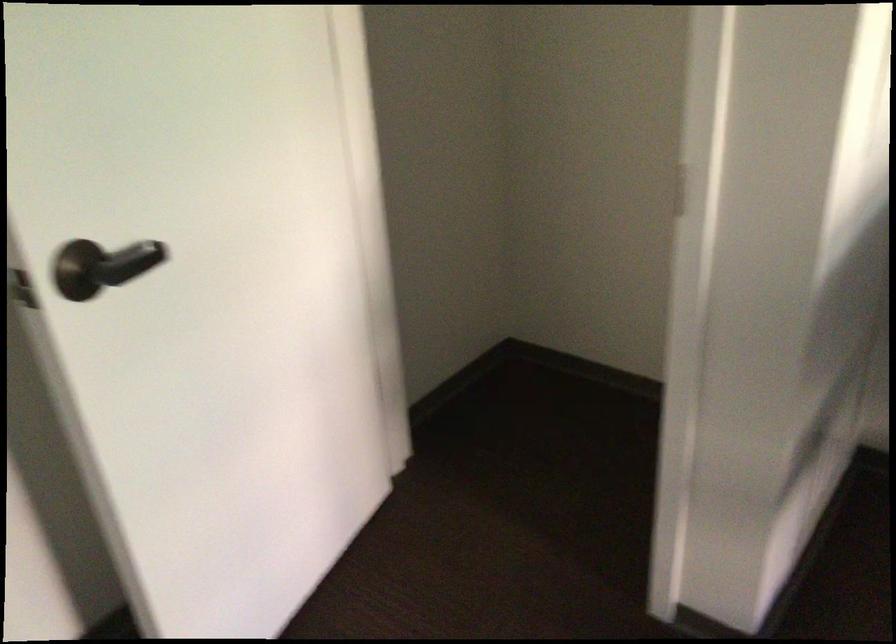
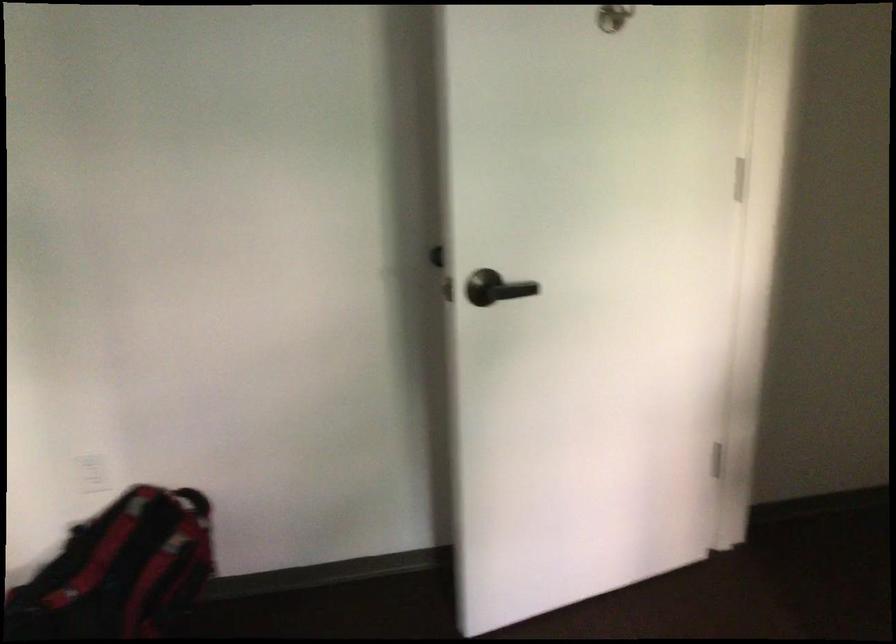
In the second image, find the point that corresponds to point (109, 269) in the first image.

(495, 288)